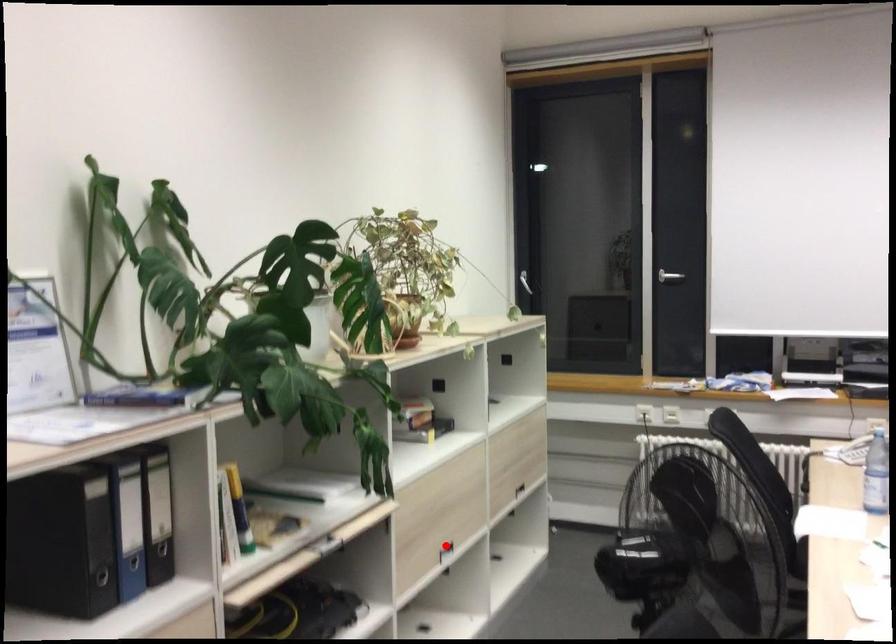
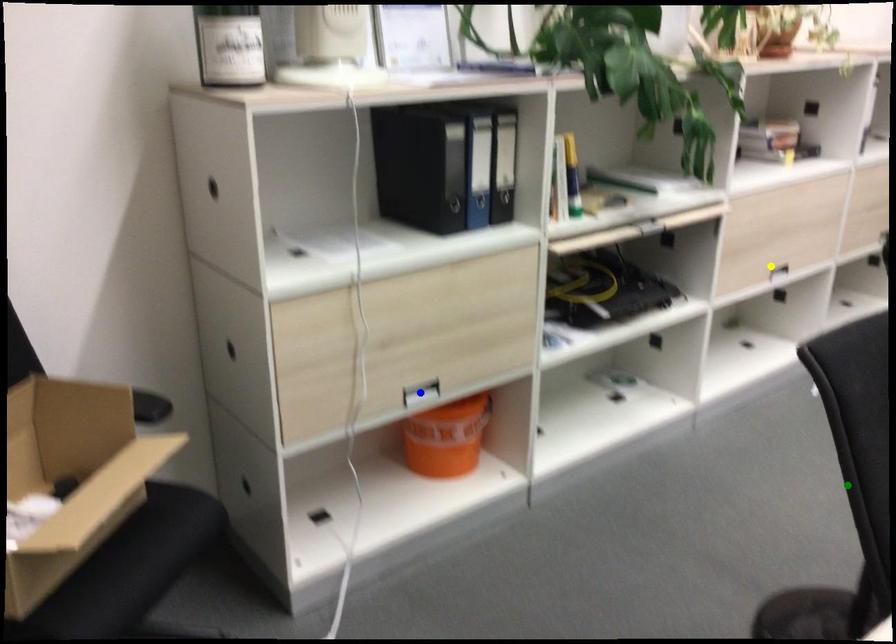
Question: I am providing you with two images of the same scene from different viewpoints. A red point is marked on the first image. You are given multiple points on the second image. Which mark in image 2 goes with the point in image 1?

Choices:
 (A) blue point
 (B) yellow point
 (C) green point

Answer: (B)